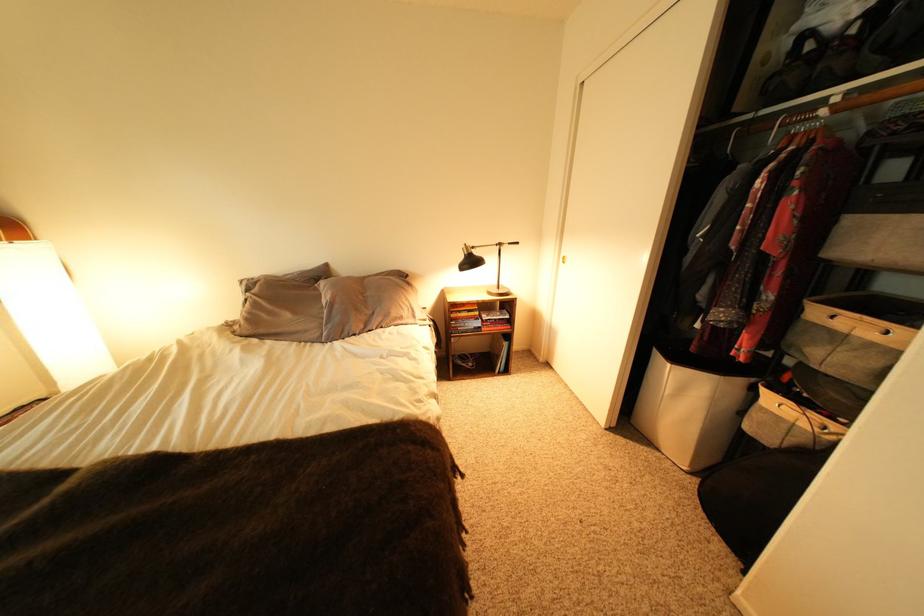
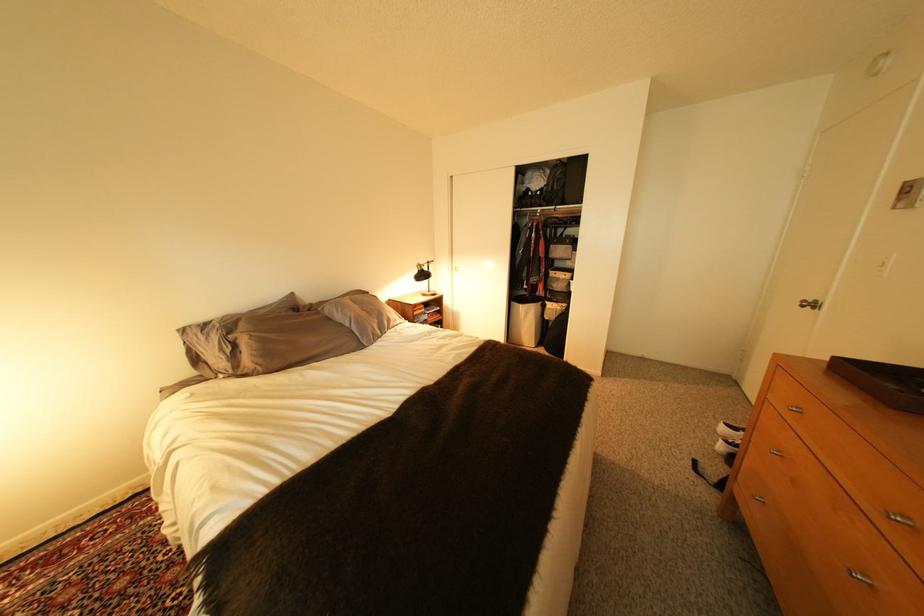
In the second image, find the point that corresponds to [332,286] in the first image.

(335, 310)